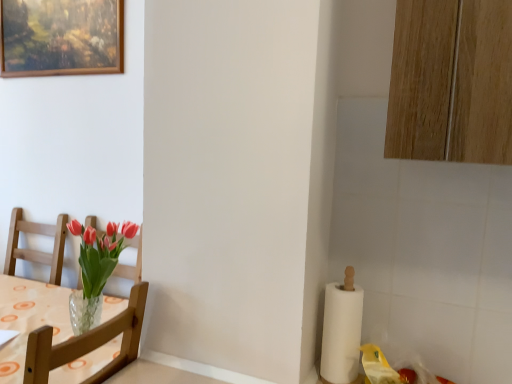
Question: Based on their positions, is wooden chair at left located to the left or right of white paper at right?

Choices:
 (A) right
 (B) left

Answer: (B)

Question: From a real-world perspective, is wooden chair at left positioned above or below white paper at right?

Choices:
 (A) below
 (B) above

Answer: (A)

Question: Estimate the real-world distances between objects in this image. Which object is closer to the wooden-framed painting at upper left?

Choices:
 (A) wooden chair at left
 (B) white paper at right

Answer: (A)

Question: Based on their relative distances, which object is nearer to the wooden chair at left?

Choices:
 (A) wooden-framed painting at upper left
 (B) white paper at right

Answer: (B)